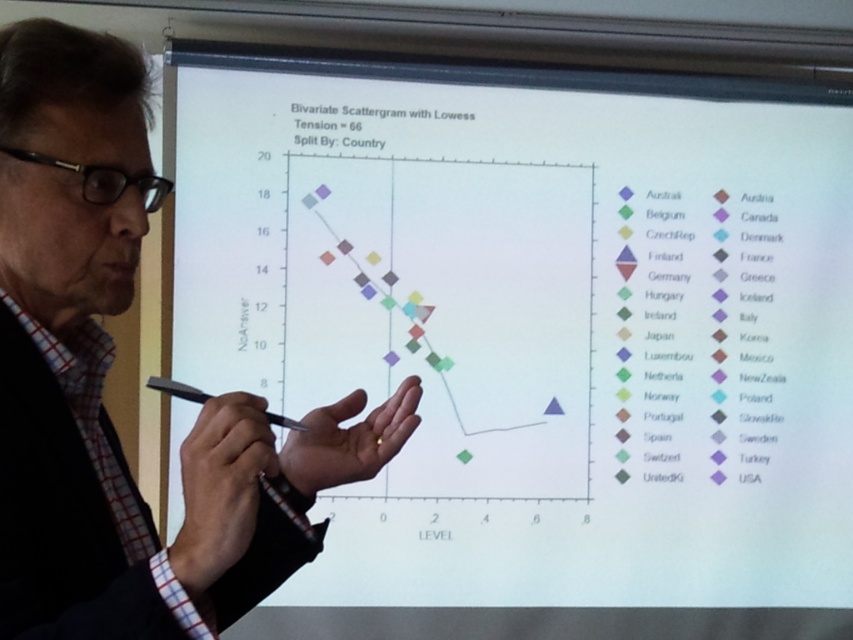
Question: Is white paper at upper center positioned behind white shirt at left?

Choices:
 (A) no
 (B) yes

Answer: (B)

Question: Is white paper at upper center positioned before white shirt at left?

Choices:
 (A) no
 (B) yes

Answer: (A)

Question: Which of the following is the farthest from the observer?

Choices:
 (A) white shirt at left
 (B) white paper at upper center

Answer: (B)

Question: Can you confirm if white paper at upper center is thinner than white shirt at left?

Choices:
 (A) no
 (B) yes

Answer: (A)

Question: Among these objects, which one is nearest to the camera?

Choices:
 (A) white shirt at left
 (B) white paper at upper center

Answer: (A)